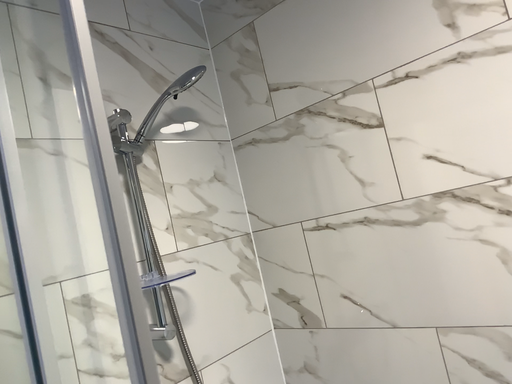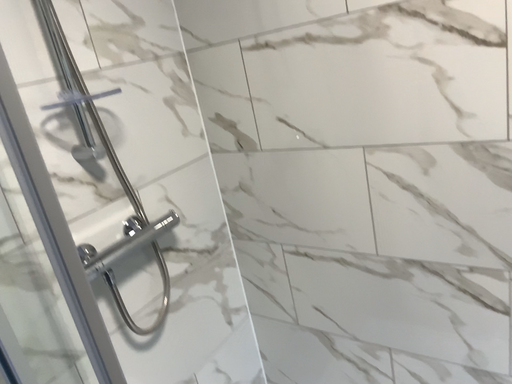
Question: Which way did the camera rotate in the video?

Choices:
 (A) rotated upward
 (B) rotated downward

Answer: (B)